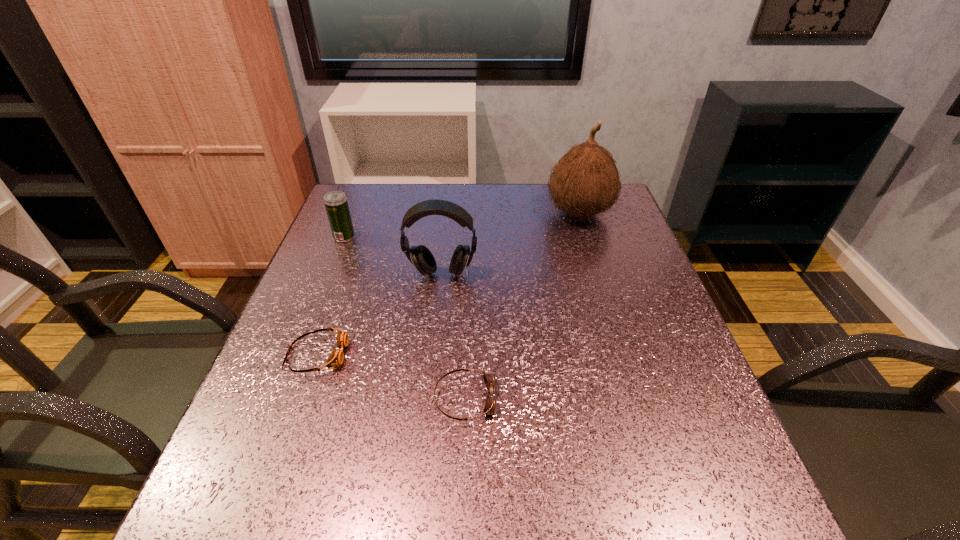
Where is `blank space at the near edge of the desktop`? The height and width of the screenshot is (540, 960). blank space at the near edge of the desktop is located at coordinates (634, 524).

Identify the location of free space at the left edge of the desktop. (361, 308).

Find the location of a particular element. free region at the right edge of the desktop is located at coordinates (675, 366).

Find the location of a particular element. The image size is (960, 540). free region at the far right corner is located at coordinates (601, 217).

Locate an element on the screen. free space between the fourth shortest object and the tallest object is located at coordinates (511, 244).

Where is `empty space between the third shortest object and the right goggles`? This screenshot has width=960, height=540. empty space between the third shortest object and the right goggles is located at coordinates tap(404, 318).

Identify the location of free space between the right goggles and the coconut. (521, 306).

Image resolution: width=960 pixels, height=540 pixels. Identify the location of vacant space in between the right goggles and the second tallest object. (453, 336).

Where is `free space between the right goggles and the earphone`? This screenshot has width=960, height=540. free space between the right goggles and the earphone is located at coordinates (453, 336).

This screenshot has height=540, width=960. I want to click on empty space between the earphone and the right goggles, so click(453, 336).